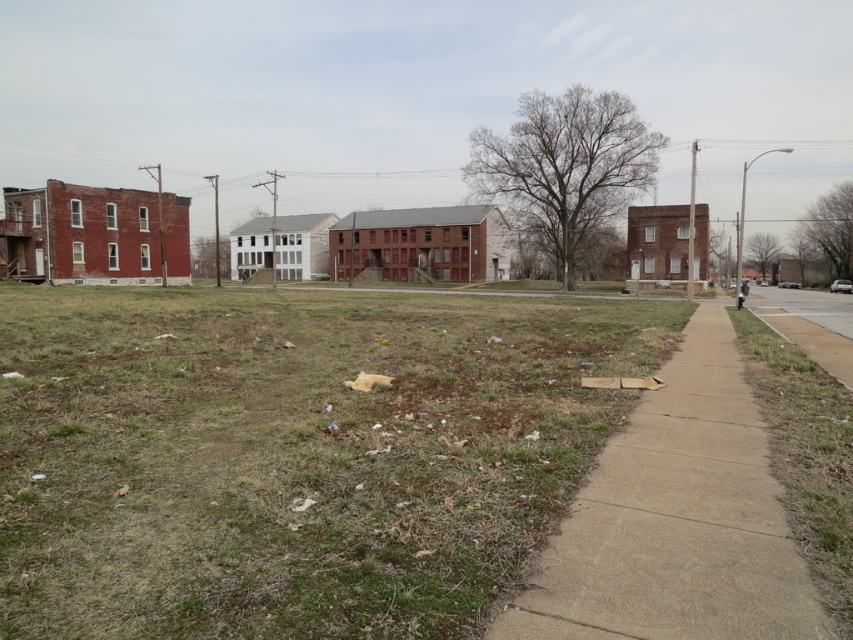
Looking at this image, is brown dry grass at lower left bigger than concrete sidewalk at lower right?

Indeed, brown dry grass at lower left has a larger size compared to concrete sidewalk at lower right.

Does point (509, 497) come farther from viewer compared to point (737, 408)?

No, it is not.

Where is `brown dry grass at lower left`? The width and height of the screenshot is (853, 640). brown dry grass at lower left is located at coordinates (292, 454).